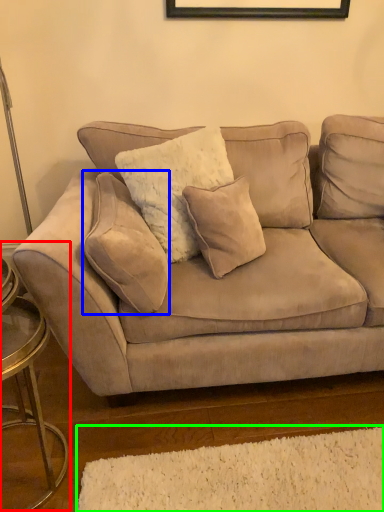
Question: Which object is positioned farthest from side table (highlighted by a red box)? Select from pillow (highlighted by a blue box) and plain (highlighted by a green box).

Choices:
 (A) pillow
 (B) plain

Answer: (B)